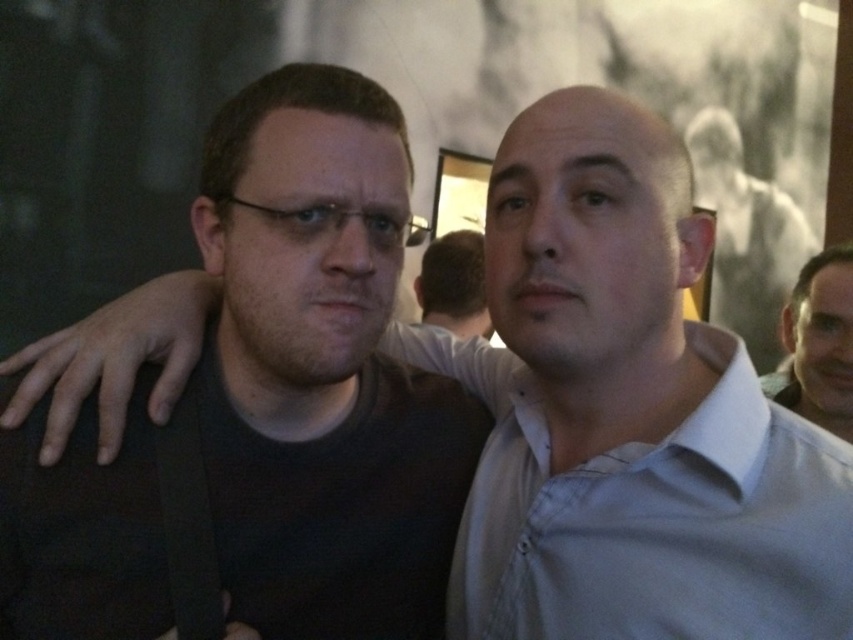
You are a photographer trying to capture a clear shot of both the smooth skin face at right and the dark brown hair at center. Since you can only focus on one subject at a time, which one should you choose to ensure at least one is in focus?

The smooth skin face at right is closer to the viewer than the dark brown hair at center, so focusing on the smooth skin face at right will ensure it is in focus while the dark brown hair at center may be slightly out of focus. Alternatively, focusing on the dark brown hair at center might leave the smooth skin face at right out of focus. To maximize clarity for at least one subject, prioritize focusing on the closer object, which is the smooth skin face at right.